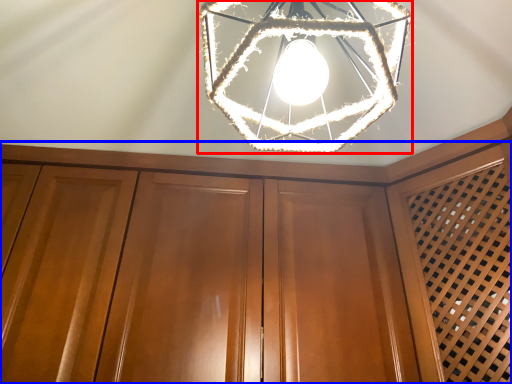
Question: Which point is further to the camera, lamp (highlighted by a red box) or dresser (highlighted by a blue box)?

Choices:
 (A) lamp
 (B) dresser

Answer: (B)